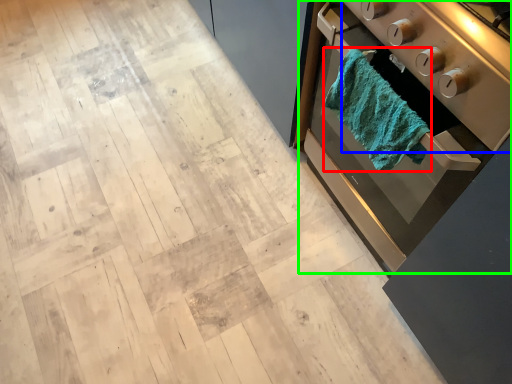
Question: Considering the real-world distances, which object is closest to bath towel (highlighted by a red box)? appliance (highlighted by a blue box) or home appliance (highlighted by a green box).

Choices:
 (A) appliance
 (B) home appliance

Answer: (B)